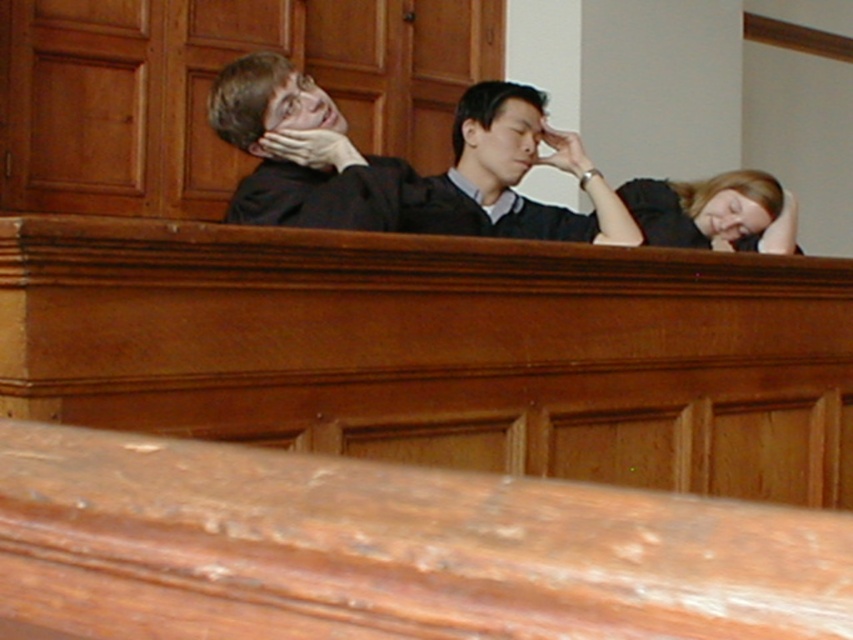
Question: Which point is farther to the camera?

Choices:
 (A) (277, 97)
 (B) (698, 212)
 (C) (509, 113)
 (D) (422, 177)

Answer: (B)

Question: Which is nearer to the matte black hair at center?

Choices:
 (A) blonde hair at upper right
 (B) matte black suit at upper left
 (C) black matte shirt at center

Answer: (C)

Question: Can you confirm if black matte shirt at center is positioned below matte black hair at center?

Choices:
 (A) yes
 (B) no

Answer: (A)

Question: Which point is farther to the camera?

Choices:
 (A) matte black suit at upper left
 (B) blonde hair at upper right

Answer: (B)

Question: In this image, where is matte black suit at upper left located relative to black matte shirt at center?

Choices:
 (A) left
 (B) right

Answer: (A)

Question: Can you confirm if matte black suit at upper left is positioned to the right of matte black hair at center?

Choices:
 (A) no
 (B) yes

Answer: (A)